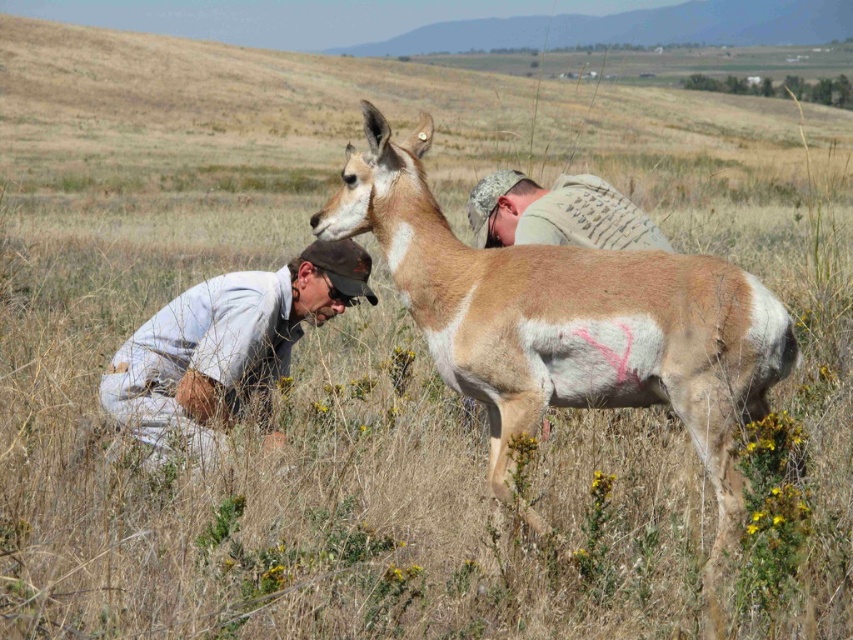
Does gray fabric shirt at lower left have a lesser width compared to camouflage fabric vest at upper center?

No.

Consider the image. Who is taller, gray fabric shirt at lower left or camouflage fabric vest at upper center?

Standing taller between the two is gray fabric shirt at lower left.

Locate an element on the screen. gray fabric shirt at lower left is located at coordinates (225, 346).

Does light brown fur at center come in front of camouflage fabric vest at upper center?

That is True.

Between light brown fur at center and camouflage fabric vest at upper center, which one appears on the left side from the viewer's perspective?

From the viewer's perspective, light brown fur at center appears more on the left side.

What are the coordinates of `light brown fur at center` in the screenshot? It's located at [x=567, y=320].

Does light brown fur at center appear over gray fabric shirt at lower left?

Yes, light brown fur at center is above gray fabric shirt at lower left.

Is light brown fur at center smaller than gray fabric shirt at lower left?

Incorrect, light brown fur at center is not smaller in size than gray fabric shirt at lower left.

Is point (637, 396) behind point (248, 348)?

No, it is in front of (248, 348).

Locate an element on the screen. This screenshot has height=640, width=853. light brown fur at center is located at coordinates 567,320.